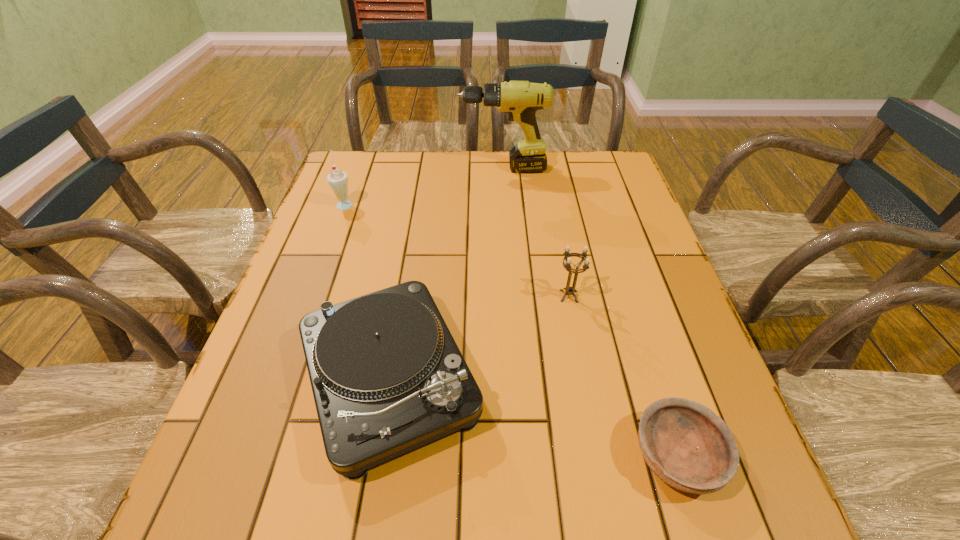
This screenshot has width=960, height=540. What are the coordinates of `object at the right edge` in the screenshot? It's located at pos(684,443).

Find the location of a particular element. The image size is (960, 540). object that is positioned at the near left corner is located at coordinates (387, 376).

The height and width of the screenshot is (540, 960). Identify the location of object located at the near right corner. (684, 443).

Image resolution: width=960 pixels, height=540 pixels. What are the coordinates of `blank space at the far edge of the desktop` in the screenshot? It's located at (574, 186).

In the image, there is a desktop. Where is `vacant area at the near edge`? The image size is (960, 540). vacant area at the near edge is located at coordinates (476, 537).

Find the location of a particular element. Image resolution: width=960 pixels, height=540 pixels. blank space at the left edge is located at coordinates (335, 237).

Image resolution: width=960 pixels, height=540 pixels. In the image, there is a desktop. What are the coordinates of `blank space at the right edge` in the screenshot? It's located at (611, 307).

The image size is (960, 540). What are the coordinates of `vacant space at the near left corner` in the screenshot? It's located at (248, 482).

Identify the location of empty space that is in between the leftmost object and the fourth tallest object. (368, 292).

Locate an element on the screen. The height and width of the screenshot is (540, 960). vacant area between the bowl and the candle holder is located at coordinates (623, 376).